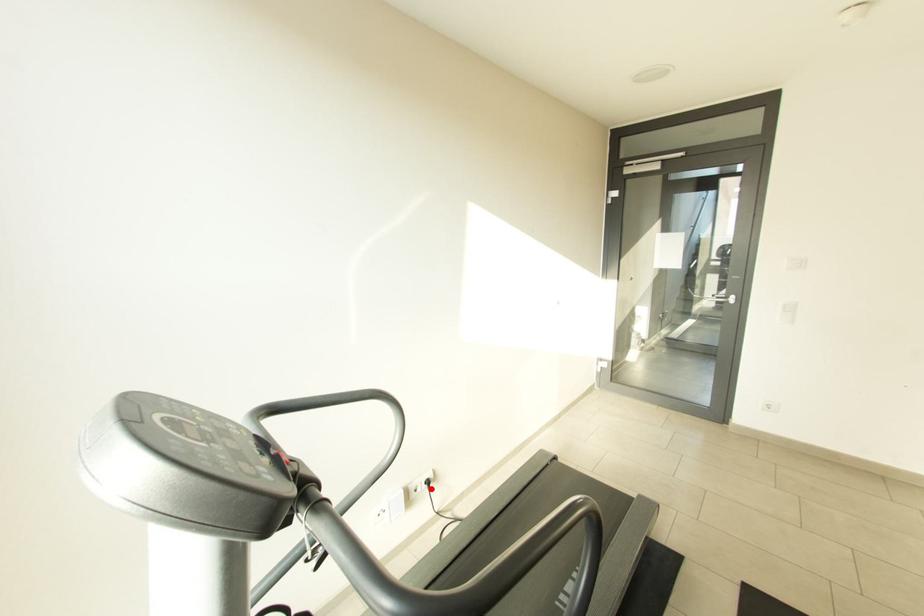
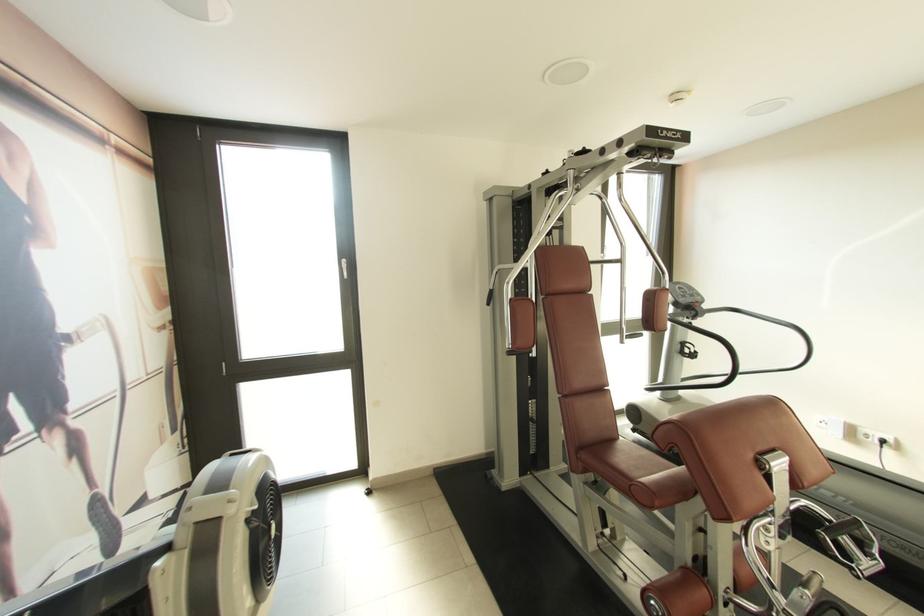
Question: I am providing you with two images of the same scene from different viewpoints. Image1 has a red point marked. In image2, the corresponding 3D location appears at what relative position? Reply with the corresponding letter.

Choices:
 (A) Closer
 (B) Farther

Answer: (A)